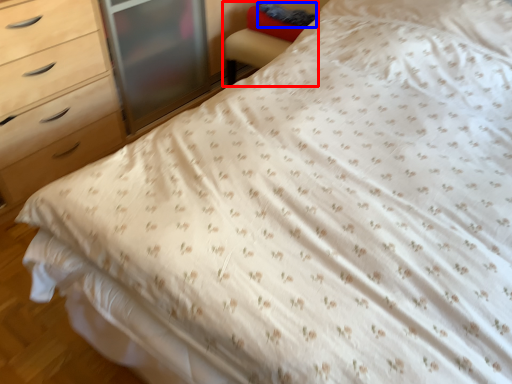
Question: Which object is further to the camera taking this photo, armchair (highlighted by a red box) or pillow (highlighted by a blue box)?

Choices:
 (A) armchair
 (B) pillow

Answer: (B)